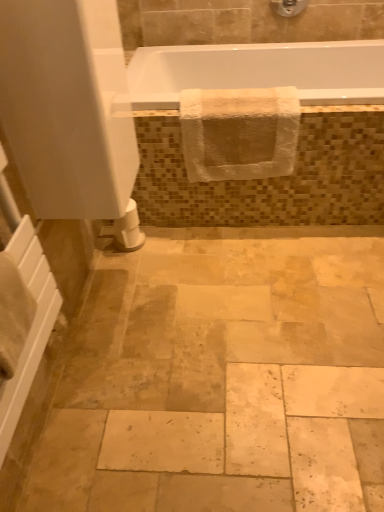
Question: Can you confirm if white matte screen door at upper left is taller than matte silver showerhead at upper center?

Choices:
 (A) no
 (B) yes

Answer: (B)

Question: Does white matte screen door at upper left come in front of matte silver showerhead at upper center?

Choices:
 (A) no
 (B) yes

Answer: (B)

Question: Does white matte screen door at upper left have a lesser height compared to matte silver showerhead at upper center?

Choices:
 (A) no
 (B) yes

Answer: (A)

Question: Is white matte screen door at upper left smaller than matte silver showerhead at upper center?

Choices:
 (A) yes
 (B) no

Answer: (B)

Question: From the image's perspective, does white matte screen door at upper left appear higher than matte silver showerhead at upper center?

Choices:
 (A) yes
 (B) no

Answer: (B)

Question: Is white matte toilet paper at lower left spatially inside white glossy bathtub at upper center, or outside of it?

Choices:
 (A) outside
 (B) inside

Answer: (A)

Question: Relative to white glossy bathtub at upper center, is white matte toilet paper at lower left in front or behind?

Choices:
 (A) behind
 (B) front

Answer: (A)

Question: Is white matte toilet paper at lower left wider or thinner than white glossy bathtub at upper center?

Choices:
 (A) wide
 (B) thin

Answer: (B)

Question: Is white matte toilet paper at lower left to the left or to the right of white glossy bathtub at upper center in the image?

Choices:
 (A) left
 (B) right

Answer: (A)

Question: Relative to matte silver showerhead at upper center, is white glossy bathtub at upper center in front or behind?

Choices:
 (A) front
 (B) behind

Answer: (A)

Question: From the image's perspective, relative to matte silver showerhead at upper center, is white glossy bathtub at upper center above or below?

Choices:
 (A) above
 (B) below

Answer: (B)

Question: Looking at the image, does white glossy bathtub at upper center seem bigger or smaller compared to matte silver showerhead at upper center?

Choices:
 (A) big
 (B) small

Answer: (A)

Question: Is point (163, 105) closer or farther from the camera than point (279, 8)?

Choices:
 (A) closer
 (B) farther

Answer: (A)

Question: Would you say white glossy bathtub at upper center is to the left or to the right of white glossy bathtub at upper center in the picture?

Choices:
 (A) left
 (B) right

Answer: (B)

Question: In terms of width, does white glossy bathtub at upper center look wider or thinner when compared to white glossy bathtub at upper center?

Choices:
 (A) thin
 (B) wide

Answer: (A)